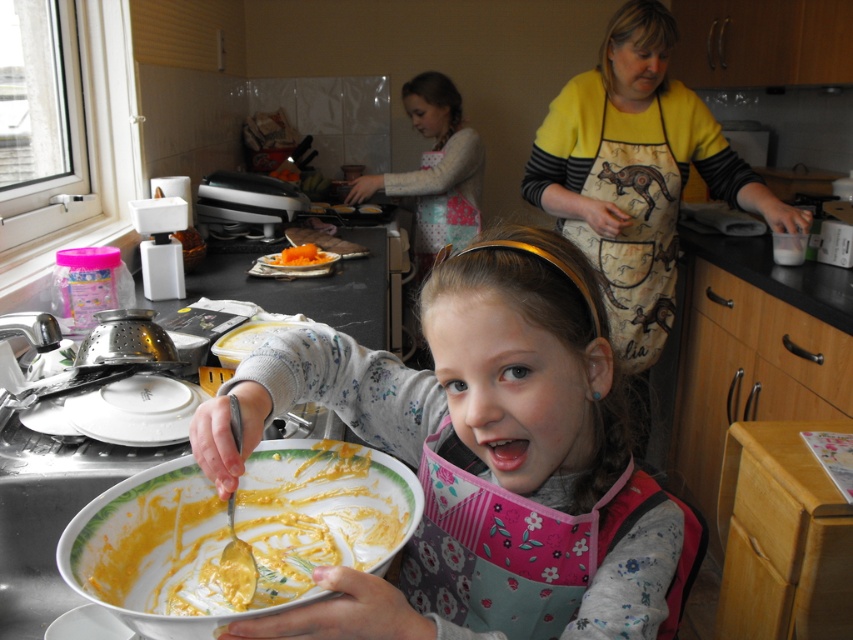
Question: Which is farther from the yellow printed fabric apron at right?

Choices:
 (A) orange smoothie at center
 (B) white matte plate at lower left

Answer: (B)

Question: Is orange matte plate at center above orange smoothie at center?

Choices:
 (A) yes
 (B) no

Answer: (B)

Question: Can you confirm if white matte plate at lower left is wider than orange smoothie at center?

Choices:
 (A) no
 (B) yes

Answer: (A)

Question: Which object appears closest to the camera in this image?

Choices:
 (A) white matte plastic container at upper right
 (B) yellow printed fabric apron at right
 (C) white glossy bowl at lower center

Answer: (C)

Question: Which object is the farthest from the matte white bowl at center?

Choices:
 (A) yellow printed fabric apron at right
 (B) orange smoothie at center
 (C) white glossy bowl at lower center
 (D) orange matte plate at center

Answer: (B)

Question: Is matte white bowl at center wider than yellow printed fabric apron at right?

Choices:
 (A) no
 (B) yes

Answer: (B)